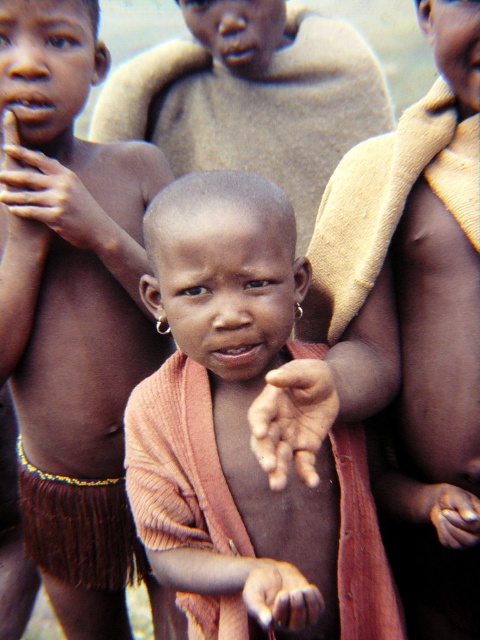
Question: Does smooth skin child at center come in front of smooth skin hand at center?

Choices:
 (A) no
 (B) yes

Answer: (A)

Question: Is dry skin hand at center above smooth skin hand at center?

Choices:
 (A) yes
 (B) no

Answer: (A)

Question: Among these points, which one is farthest from the camera?

Choices:
 (A) (75, 236)
 (B) (162, 490)
 (C) (452, 508)
 (D) (129, 88)

Answer: (D)

Question: Which point is farther from the camera taking this photo?

Choices:
 (A) (312, 48)
 (B) (458, 525)

Answer: (A)

Question: Which of the following is the farthest from the observer?

Choices:
 (A) (295, 568)
 (B) (358, 131)
 (C) (252, 440)
 (D) (162, 358)

Answer: (B)

Question: Is smooth skin hand at center thinner than smooth brown hand at center?

Choices:
 (A) no
 (B) yes

Answer: (A)